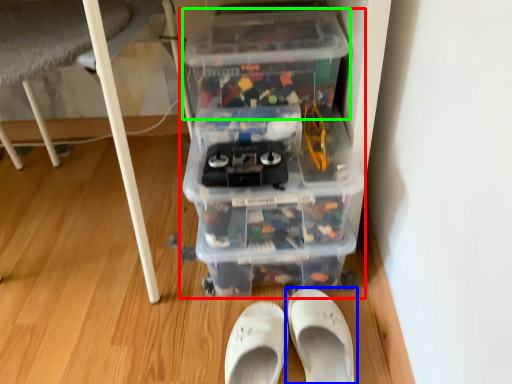
Question: Considering the real-world distances, which object is farthest from storage box (highlighted by a red box)? footwear (highlighted by a blue box) or storage box (highlighted by a green box)?

Choices:
 (A) footwear
 (B) storage box

Answer: (A)